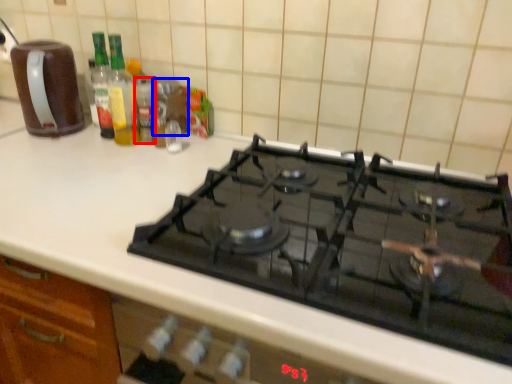
Question: Which object is closer to the camera taking this photo, bottle (highlighted by a red box) or appliance (highlighted by a blue box)?

Choices:
 (A) bottle
 (B) appliance

Answer: (A)